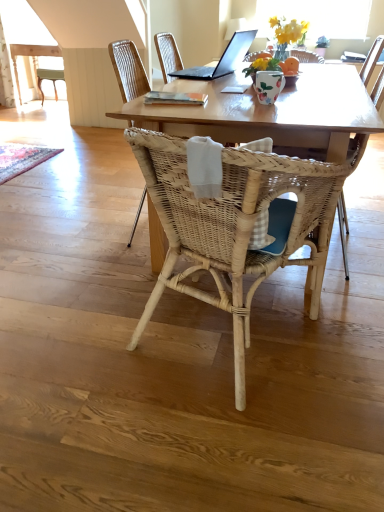
Locate an element on the screen. free space to the left of woven wood chair at center, positioned as the first chair in front-to-back order is located at coordinates (82, 328).